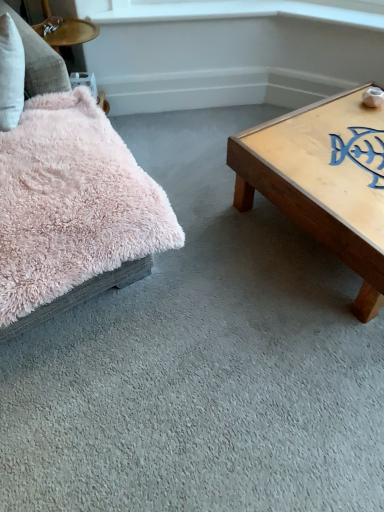
Describe the element at coordinates (233, 10) in the screenshot. I see `white glossy window sill at upper center` at that location.

This screenshot has width=384, height=512. I want to click on fluffy pink pillow at left, so click(74, 212).

The height and width of the screenshot is (512, 384). What are the coordinates of `white glossy window sill at upper center` in the screenshot? It's located at (233, 10).

Which is farther, (312,5) or (66,209)?

Positioned behind is point (312,5).

Is white glossy window sill at upper center next to fluffy pink pillow at left and touching it?

No, white glossy window sill at upper center is not with fluffy pink pillow at left.

Looking at this image, is white glossy window sill at upper center positioned with its back to fluffy pink pillow at left?

No.

Is light brown wooden coffee table at right oriented away from fluffy pink pillow at left?

light brown wooden coffee table at right is not turned away from fluffy pink pillow at left.

Does light brown wooden coffee table at right touch fluffy pink pillow at left?

No, light brown wooden coffee table at right is not with fluffy pink pillow at left.

Does light brown wooden coffee table at right have a smaller size compared to fluffy pink pillow at left?

Correct, light brown wooden coffee table at right occupies less space than fluffy pink pillow at left.

Considering their positions, is white glossy window sill at upper center located in front of or behind fuzzy pink pillow at upper left?

Clearly, white glossy window sill at upper center is behind fuzzy pink pillow at upper left.

Is fuzzy pink pillow at upper left at the back of white glossy window sill at upper center?

No, white glossy window sill at upper center's orientation is not away from fuzzy pink pillow at upper left.

Consider the image. From a real-world perspective, is white glossy window sill at upper center over fuzzy pink pillow at upper left?

Actually, white glossy window sill at upper center is physically below fuzzy pink pillow at upper left in the real world.

Can you confirm if white glossy window sill at upper center is smaller than fuzzy pink pillow at upper left?

Yes.

From the image's perspective, which one is positioned lower, fuzzy pink pillow at upper left or light brown wooden coffee table at right?

light brown wooden coffee table at right appears lower in the image.

Is light brown wooden coffee table at right inside fuzzy pink pillow at upper left?

No, fuzzy pink pillow at upper left does not contain light brown wooden coffee table at right.

Which point is more distant from viewer, (53, 82) or (256, 161)?

Point (256, 161)

Which is in front, fuzzy pink pillow at upper left or light brown wooden coffee table at right?

fuzzy pink pillow at upper left is in front.

Is point (104, 178) more distant than point (97, 21)?

No, (104, 178) is in front of (97, 21).

From the image's perspective, is fluffy pink pillow at left above white glossy window sill at upper center?

No, from the image's perspective, fluffy pink pillow at left is not on top of white glossy window sill at upper center.

From a real-world perspective, is fluffy pink pillow at left positioned over white glossy window sill at upper center based on gravity?

No.

Is fluffy pink pillow at left not near white glossy window sill at upper center?

Indeed, fluffy pink pillow at left is not near white glossy window sill at upper center.

I want to click on pillow located above the fluffy pink pillow at left (from a real-world perspective), so click(x=39, y=60).

Considering the sizes of fluffy pink pillow at left and fuzzy pink pillow at upper left in the image, is fluffy pink pillow at left bigger or smaller than fuzzy pink pillow at upper left?

Clearly, fluffy pink pillow at left is larger in size than fuzzy pink pillow at upper left.

From the image's perspective, between fluffy pink pillow at left and fuzzy pink pillow at upper left, who is located below?

fluffy pink pillow at left.

Which is behind, light brown wooden coffee table at right or white glossy window sill at upper center?

Positioned behind is white glossy window sill at upper center.

Is light brown wooden coffee table at right bigger than white glossy window sill at upper center?

Yes.

From a real-world perspective, is light brown wooden coffee table at right on white glossy window sill at upper center?

No, from a real-world perspective, light brown wooden coffee table at right is not on top of white glossy window sill at upper center.

Are light brown wooden coffee table at right and white glossy window sill at upper center far apart?

light brown wooden coffee table at right is actually quite close to white glossy window sill at upper center.

The image size is (384, 512). I want to click on furniture below the white glossy window sill at upper center (from the image's perspective), so point(74,212).

Image resolution: width=384 pixels, height=512 pixels. Identify the location of furniture that appears above the light brown wooden coffee table at right (from a real-world perspective). (74, 212).

Which object lies further to the anchor point light brown wooden coffee table at right, fluffy pink pillow at left or fuzzy pink pillow at upper left?

fuzzy pink pillow at upper left.

Estimate the real-world distances between objects in this image. Which object is closer to fluffy pink pillow at left, fuzzy pink pillow at upper left or white glossy window sill at upper center?

fuzzy pink pillow at upper left.

Estimate the real-world distances between objects in this image. Which object is closer to fluffy pink pillow at left, white glossy window sill at upper center or fuzzy pink pillow at upper left?

fuzzy pink pillow at upper left.

From the picture: Based on their spatial positions, is fluffy pink pillow at left or white glossy window sill at upper center closer to fuzzy pink pillow at upper left?

Among the two, fluffy pink pillow at left is located nearer to fuzzy pink pillow at upper left.

From the image, which object appears to be nearer to fluffy pink pillow at left, light brown wooden coffee table at right or fuzzy pink pillow at upper left?

Based on the image, fuzzy pink pillow at upper left appears to be nearer to fluffy pink pillow at left.

From the image, which object appears to be nearer to fuzzy pink pillow at upper left, white glossy window sill at upper center or light brown wooden coffee table at right?

Among the two, white glossy window sill at upper center is located nearer to fuzzy pink pillow at upper left.

Considering their positions, is fuzzy pink pillow at upper left positioned closer to white glossy window sill at upper center than fluffy pink pillow at left?

fuzzy pink pillow at upper left is positioned closer to the anchor white glossy window sill at upper center.

From the image, which object appears to be farther from white glossy window sill at upper center, light brown wooden coffee table at right or fluffy pink pillow at left?

The object further to white glossy window sill at upper center is fluffy pink pillow at left.

In order to click on pillow located between fluffy pink pillow at left and white glossy window sill at upper center in the depth direction in this screenshot , I will do `click(39, 60)`.

Locate an element on the screen. window sill situated between fuzzy pink pillow at upper left and light brown wooden coffee table at right from left to right is located at coordinates (233, 10).

At what (x,y) coordinates should I click in order to perform the action: click on window sill between fluffy pink pillow at left and light brown wooden coffee table at right in the horizontal direction. Please return your answer as a coordinate pair (x, y). The image size is (384, 512). Looking at the image, I should click on (233, 10).

You are a GUI agent. You are given a task and a screenshot of the screen. Output one action in this format:
    pyautogui.click(x=<x>, y=<y>)
    Task: Click on the furniture between fuzzy pink pillow at upper left and light brown wooden coffee table at right
    The image size is (384, 512).
    Given the screenshot: What is the action you would take?
    pyautogui.click(x=74, y=212)